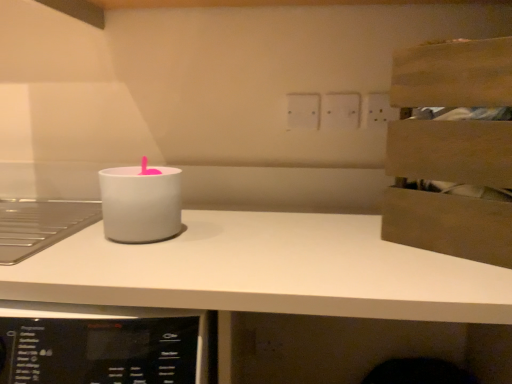
Measure the distance between point (109, 234) and camera.

Point (109, 234) is 30.28 inches from camera.

This screenshot has height=384, width=512. What do you see at coordinates (278, 269) in the screenshot?
I see `white matte countertop at center` at bounding box center [278, 269].

Measure the distance between white plastic electric outlet at upper center, the 2th electric outlet when ordered from left to right, and camera.

1.08 meters.

Identify the location of white plastic electric outlet at upper center, positioned as the 1th electric outlet in left-to-right order. The width and height of the screenshot is (512, 384). (303, 111).

Find the location of a particular element. The width and height of the screenshot is (512, 384). white matte candle holder at center is located at coordinates (140, 203).

From a real-world perspective, is white matte candle holder at center located beneath white plastic electric outlet at upper center, which appears as the second electric outlet when viewed from the right?

Yes.

Considering the sizes of white matte candle holder at center and white plastic electric outlet at upper center, positioned as the 1th electric outlet in left-to-right order, in the image, is white matte candle holder at center taller or shorter than white plastic electric outlet at upper center, positioned as the 1th electric outlet in left-to-right order,?

white matte candle holder at center is taller than white plastic electric outlet at upper center, positioned as the 1th electric outlet in left-to-right order.

What's the angular difference between white matte candle holder at center and white plastic electric outlet at upper center, which appears as the second electric outlet when viewed from the right,'s facing directions?

2.01 degrees separate the facing orientations of white matte candle holder at center and white plastic electric outlet at upper center, which appears as the second electric outlet when viewed from the right.

Looking at this image, from the image's perspective, is white matte candle holder at center located above white plastic electric outlet at upper center, positioned as the 1th electric outlet in left-to-right order?

No, from the image's perspective, white matte candle holder at center is not on top of white plastic electric outlet at upper center, positioned as the 1th electric outlet in left-to-right order.

In terms of size, does white plastic electric outlet at upper center, the first electric outlet viewed from the right, appear bigger or smaller than white plastic electric outlet at upper center, which appears as the second electric outlet when viewed from the right?

white plastic electric outlet at upper center, the first electric outlet viewed from the right, is bigger than white plastic electric outlet at upper center, which appears as the second electric outlet when viewed from the right.

Considering the relative positions of white plastic electric outlet at upper center, the first electric outlet viewed from the right, and white plastic electric outlet at upper center, positioned as the 1th electric outlet in left-to-right order, in the image provided, is white plastic electric outlet at upper center, the first electric outlet viewed from the right, to the left of white plastic electric outlet at upper center, positioned as the 1th electric outlet in left-to-right order, from the viewer's perspective?

In fact, white plastic electric outlet at upper center, the first electric outlet viewed from the right, is to the right of white plastic electric outlet at upper center, positioned as the 1th electric outlet in left-to-right order.

From the image's perspective, is white plastic electric outlet at upper center, the 2th electric outlet when ordered from left to right, over white plastic electric outlet at upper center, positioned as the 1th electric outlet in left-to-right order?

No, from the image's perspective, white plastic electric outlet at upper center, the 2th electric outlet when ordered from left to right, is not on top of white plastic electric outlet at upper center, positioned as the 1th electric outlet in left-to-right order.

Between wooden crate at upper right and white plastic electric outlet at upper center, positioned as the 1th electric outlet in left-to-right order, which one appears on the right side from the viewer's perspective?

wooden crate at upper right.

Based on the photo, between wooden crate at upper right and white plastic electric outlet at upper center, which appears as the second electric outlet when viewed from the right, which one is positioned behind?

Positioned behind is white plastic electric outlet at upper center, which appears as the second electric outlet when viewed from the right.

Is wooden crate at upper right far away from white plastic electric outlet at upper center, which appears as the second electric outlet when viewed from the right?

That's not correct — wooden crate at upper right is a little close to white plastic electric outlet at upper center, which appears as the second electric outlet when viewed from the right.

Between wooden crate at upper right and white plastic electric outlet at upper center, which appears as the second electric outlet when viewed from the right, which one has larger size?

Bigger between the two is wooden crate at upper right.

From a real-world perspective, which is physically above, white matte countertop at center or white plastic electric outlet at upper center, the 2th electric outlet when ordered from left to right?

In real-world perspective, white plastic electric outlet at upper center, the 2th electric outlet when ordered from left to right, is above.

Can we say white matte countertop at center lies outside white plastic electric outlet at upper center, the 2th electric outlet when ordered from left to right?

white matte countertop at center lies outside white plastic electric outlet at upper center, the 2th electric outlet when ordered from left to right,'s area.

From the image's perspective, is white matte countertop at center on top of white plastic electric outlet at upper center, the 2th electric outlet when ordered from left to right?

No, from the image's perspective, white matte countertop at center is not on top of white plastic electric outlet at upper center, the 2th electric outlet when ordered from left to right.

Is point (202, 302) closer to viewer compared to point (347, 94)?

Yes, it is.

Based on the photo, could you tell me if white plastic electric outlet at upper center, positioned as the 1th electric outlet in left-to-right order, is turned towards wooden crate at upper right?

No.

Which is in front, point (288, 126) or point (397, 180)?

The point (397, 180) is in front.

From a real-world perspective, is white plastic electric outlet at upper center, positioned as the 1th electric outlet in left-to-right order, under wooden crate at upper right?

No, from a real-world perspective, white plastic electric outlet at upper center, positioned as the 1th electric outlet in left-to-right order, is not beneath wooden crate at upper right.

Which of these two, white plastic electric outlet at upper center, positioned as the 1th electric outlet in left-to-right order, or wooden crate at upper right, stands taller?

With more height is wooden crate at upper right.

Does wooden crate at upper right have a lesser width compared to white matte candle holder at center?

In fact, wooden crate at upper right might be wider than white matte candle holder at center.

Is wooden crate at upper right looking in the opposite direction of white matte candle holder at center?

No, white matte candle holder at center is not at the back of wooden crate at upper right.

Where is `cabinetry above the white matte candle holder at center (from the image's perspective)`? The height and width of the screenshot is (384, 512). cabinetry above the white matte candle holder at center (from the image's perspective) is located at coordinates (454, 183).

Between white plastic electric outlet at upper center, the 2th electric outlet when ordered from left to right, and white matte countertop at center, which one has less height?

white plastic electric outlet at upper center, the 2th electric outlet when ordered from left to right.

Looking at this image, based on their sizes in the image, would you say white plastic electric outlet at upper center, the first electric outlet viewed from the right, is bigger or smaller than white matte countertop at center?

white plastic electric outlet at upper center, the first electric outlet viewed from the right, is smaller than white matte countertop at center.

How many degrees apart are the facing directions of white plastic electric outlet at upper center, the first electric outlet viewed from the right, and white matte countertop at center?

The angle between the facing direction of white plastic electric outlet at upper center, the first electric outlet viewed from the right, and the facing direction of white matte countertop at center is 2.44 degrees.

Is white plastic electric outlet at upper center, the first electric outlet viewed from the right, thinner than white matte countertop at center?

Yes, white plastic electric outlet at upper center, the first electric outlet viewed from the right, is thinner than white matte countertop at center.

Where is `candle holder that appears in front of the white plastic electric outlet at upper center, which appears as the second electric outlet when viewed from the right`? The height and width of the screenshot is (384, 512). candle holder that appears in front of the white plastic electric outlet at upper center, which appears as the second electric outlet when viewed from the right is located at coordinates (140, 203).

Where is `electric outlet above the white plastic electric outlet at upper center, the 2th electric outlet when ordered from left to right (from the image's perspective)`? Image resolution: width=512 pixels, height=384 pixels. electric outlet above the white plastic electric outlet at upper center, the 2th electric outlet when ordered from left to right (from the image's perspective) is located at coordinates (303, 111).

Estimate the real-world distances between objects in this image. Which object is further from white matte countertop at center, white matte candle holder at center or wooden crate at upper right?

wooden crate at upper right is further to white matte countertop at center.

Considering their positions, is white plastic electric outlet at upper center, the 2th electric outlet when ordered from left to right, positioned further to white matte countertop at center than wooden crate at upper right?

white plastic electric outlet at upper center, the 2th electric outlet when ordered from left to right, is further to white matte countertop at center.

Looking at the image, which one is located further to wooden crate at upper right, white plastic electric outlet at upper center, the 2th electric outlet when ordered from left to right, or white matte candle holder at center?

white matte candle holder at center.

When comparing their distances from white plastic electric outlet at upper center, positioned as the 1th electric outlet in left-to-right order, does wooden crate at upper right or white plastic electric outlet at upper center, the first electric outlet viewed from the right, seem closer?

The object closer to white plastic electric outlet at upper center, positioned as the 1th electric outlet in left-to-right order, is white plastic electric outlet at upper center, the first electric outlet viewed from the right.

Considering their positions, is white matte candle holder at center positioned closer to white plastic electric outlet at upper center, the 2th electric outlet when ordered from left to right, than wooden crate at upper right?

wooden crate at upper right is positioned closer to the anchor white plastic electric outlet at upper center, the 2th electric outlet when ordered from left to right.

Looking at the image, which one is located further to white plastic electric outlet at upper center, the 2th electric outlet when ordered from left to right, white matte candle holder at center or white matte countertop at center?

white matte candle holder at center lies further to white plastic electric outlet at upper center, the 2th electric outlet when ordered from left to right, than the other object.

From the picture: Which object lies further to the anchor point wooden crate at upper right, white matte candle holder at center or white plastic electric outlet at upper center, the 2th electric outlet when ordered from left to right?

Among the two, white matte candle holder at center is located further to wooden crate at upper right.

Considering their positions, is wooden crate at upper right positioned further to white matte candle holder at center than white plastic electric outlet at upper center, positioned as the 1th electric outlet in left-to-right order?

white plastic electric outlet at upper center, positioned as the 1th electric outlet in left-to-right order, lies further to white matte candle holder at center than the other object.

Identify the location of cabinetry between white matte countertop at center and white plastic electric outlet at upper center, the first electric outlet viewed from the right, in the front-back direction. (454, 183).

Find the location of a particular element. The image size is (512, 384). electric outlet located between wooden crate at upper right and white plastic electric outlet at upper center, positioned as the 1th electric outlet in left-to-right order, in the depth direction is located at coordinates (340, 111).

Locate an element on the screen. Image resolution: width=512 pixels, height=384 pixels. electric outlet located between white matte candle holder at center and white plastic electric outlet at upper center, the 2th electric outlet when ordered from left to right, in the left-right direction is located at coordinates coord(303,111).

Where is `cabinetry positioned between white matte countertop at center and white plastic electric outlet at upper center, which appears as the second electric outlet when viewed from the right, from near to far`? This screenshot has width=512, height=384. cabinetry positioned between white matte countertop at center and white plastic electric outlet at upper center, which appears as the second electric outlet when viewed from the right, from near to far is located at coordinates (454, 183).